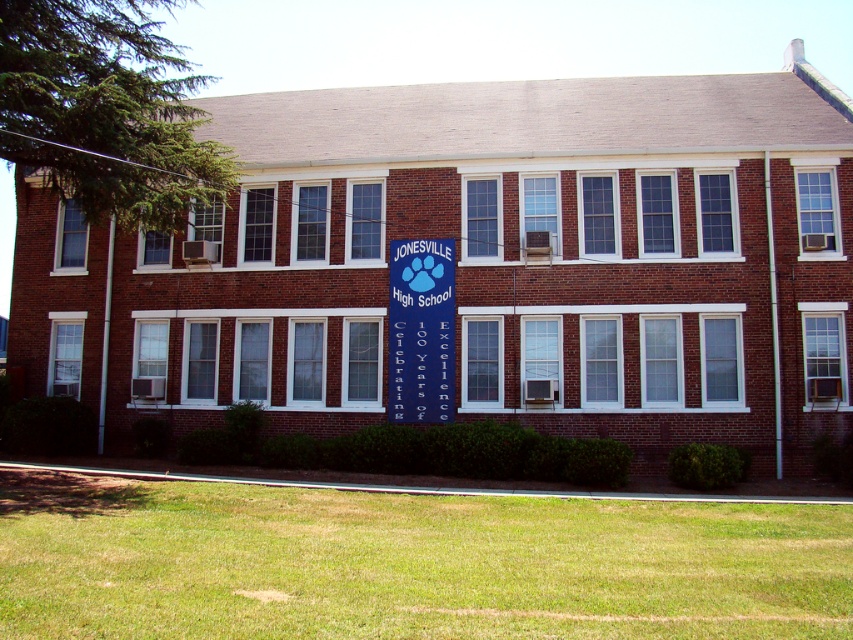
Question: Is brick building at center wider than green grass at lower center?

Choices:
 (A) no
 (B) yes

Answer: (B)

Question: Does green grass at lower center appear on the left side of blue fabric banner at center?

Choices:
 (A) yes
 (B) no

Answer: (A)

Question: Based on their relative distances, which object is nearer to the green grass at lower center?

Choices:
 (A) brick building at center
 (B) blue fabric banner at center

Answer: (B)

Question: Is green grass at lower center thinner than blue fabric banner at center?

Choices:
 (A) no
 (B) yes

Answer: (A)

Question: Which object appears farthest from the camera in this image?

Choices:
 (A) brick building at center
 (B) blue fabric banner at center

Answer: (B)

Question: Estimate the real-world distances between objects in this image. Which object is closer to the brick building at center?

Choices:
 (A) blue fabric banner at center
 (B) green grass at lower center

Answer: (A)